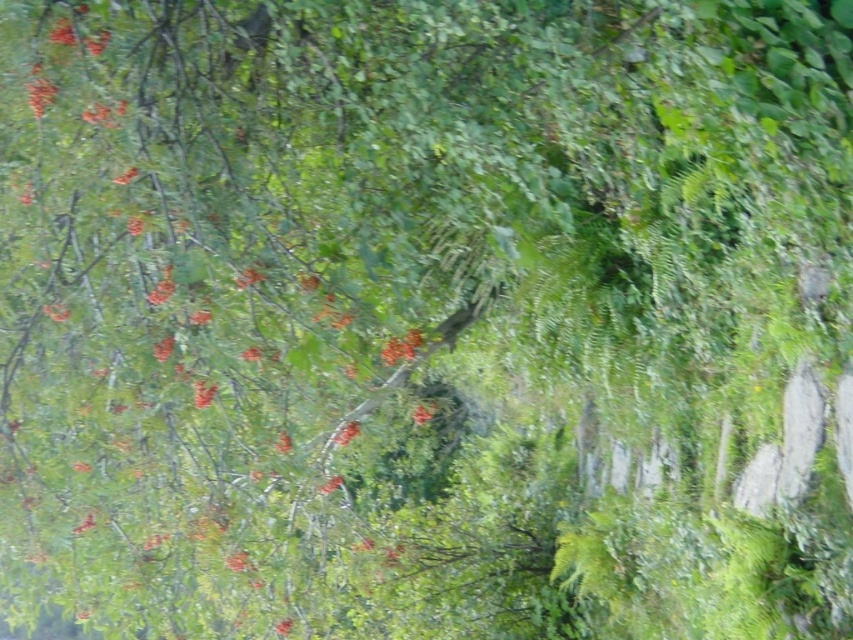
You are standing at the point with coordinates (x=401, y=348) in the forest. What object are you standing on?

You are standing on the glossy red flower at center.

You are a botanist studying the flora in this forest. You notice an orange matte flower at center and bright orange berries at center. Which of these two has a larger physical size?

The bright orange berries at center are larger in size than the orange matte flower at center, as the orange matte flower at center occupies less space.